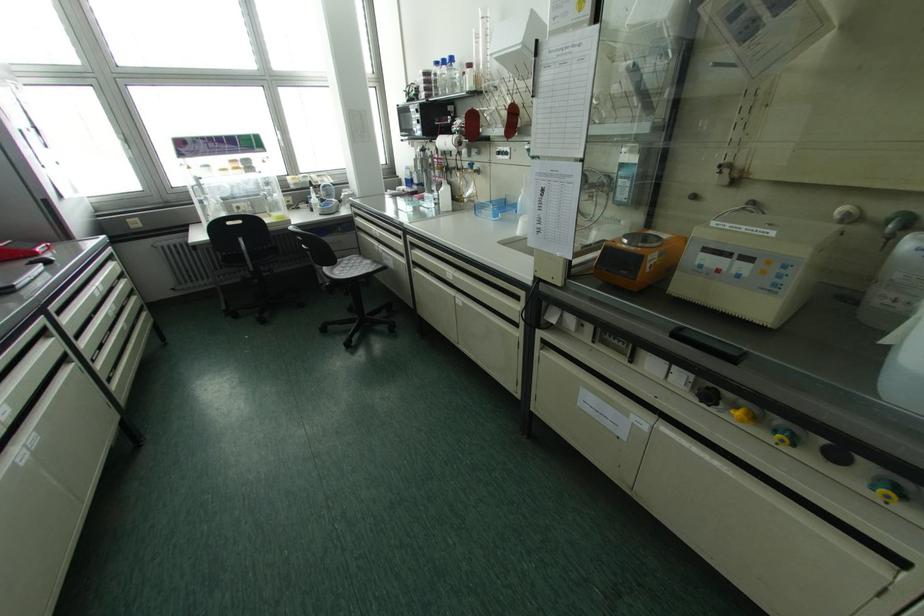
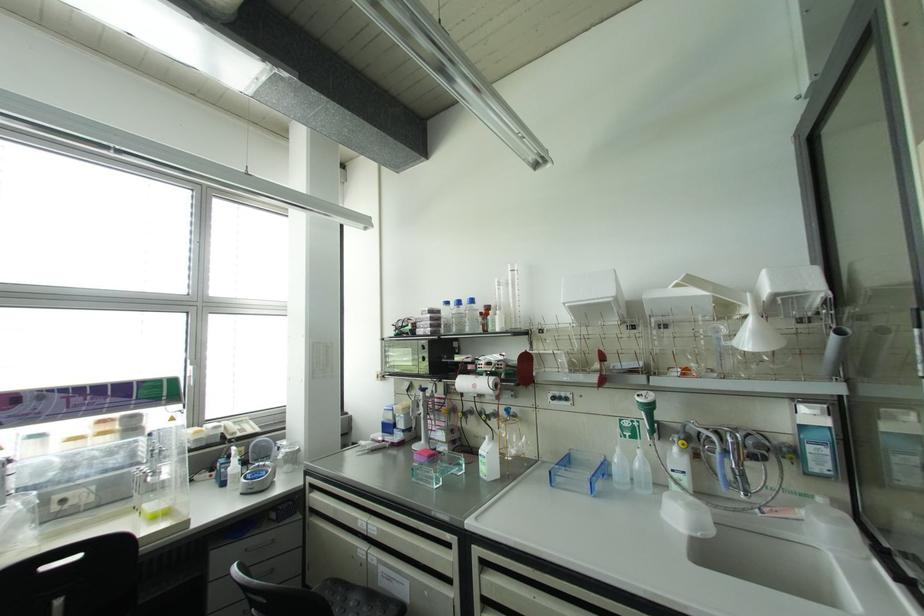
In the second image, find the point that corresponds to [410,243] in the first image.

(482, 562)